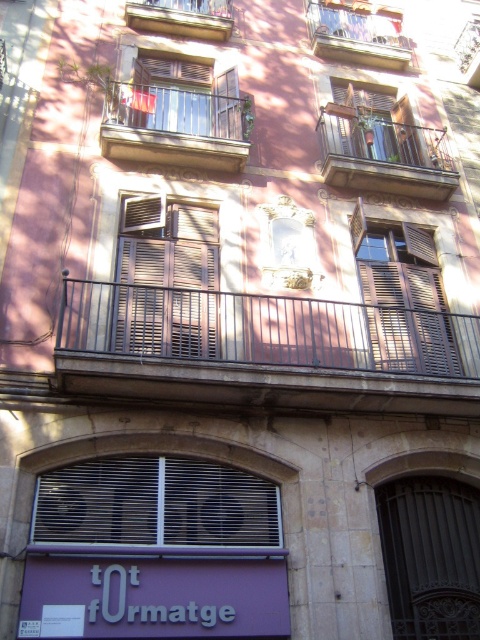
You are standing in front of the building and want to hang a small decorative flag on the balcony that is closest to you. Which balcony should you choose between the metallic gray balcony at center and the wooden brown balcony at upper center?

The metallic gray balcony at center is in front of the wooden brown balcony at upper center, so the metallic gray balcony at center is closer to you. You should choose the metallic gray balcony at center to hang the flag.